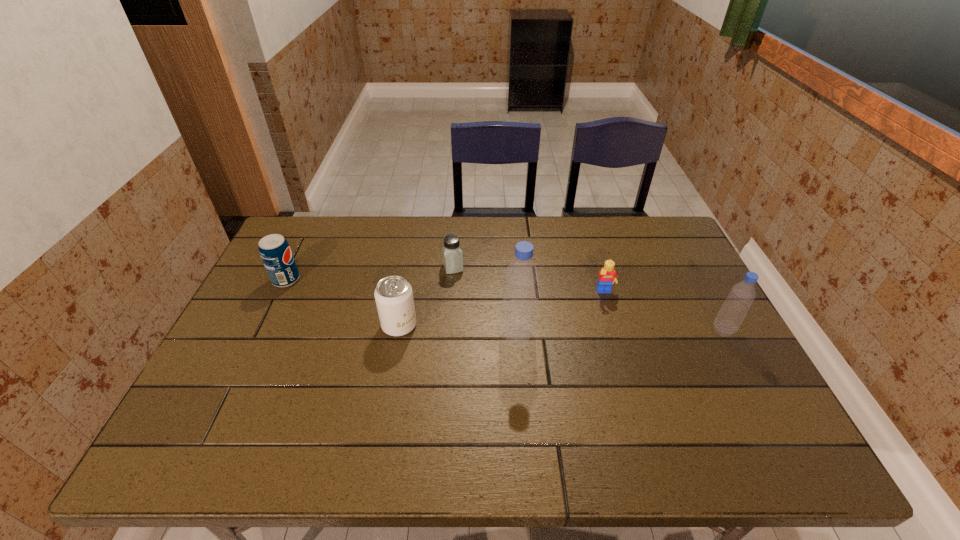
Where is `free spot at the left edge of the desktop`? This screenshot has height=540, width=960. free spot at the left edge of the desktop is located at coordinates [x=268, y=329].

The width and height of the screenshot is (960, 540). What are the coordinates of `vacant space at the right edge of the desktop` in the screenshot? It's located at (745, 380).

The image size is (960, 540). I want to click on vacant space at the far left corner, so click(x=305, y=257).

Locate an element on the screen. This screenshot has width=960, height=540. free region at the near left corner is located at coordinates (215, 414).

Identify the location of free space at the far right corner of the desktop. (656, 258).

Locate an element on the screen. This screenshot has height=540, width=960. free space between the tallest object and the second object from left to right is located at coordinates (458, 330).

Identify the location of free space between the third object from right to left and the rightmost object. The image size is (960, 540). (620, 333).

Find the location of a particular element. unoccupied position between the shorter bottle and the saltshaker is located at coordinates (588, 299).

Where is `free point between the second object from right to left and the tallest object`? free point between the second object from right to left and the tallest object is located at coordinates (561, 314).

Where is `vacant space in between the fourth object from left to right and the shorter bottle`? The width and height of the screenshot is (960, 540). vacant space in between the fourth object from left to right and the shorter bottle is located at coordinates (620, 333).